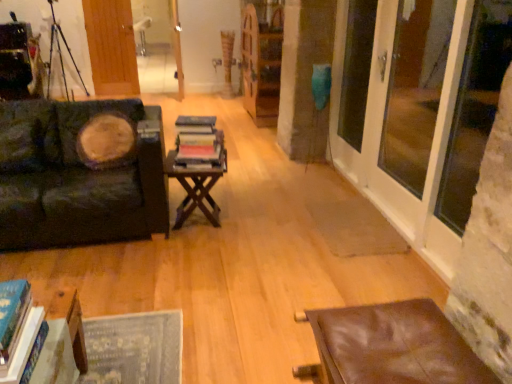
The width and height of the screenshot is (512, 384). Find the location of `free spot above hardcover books at center (from a real-world perspective)`. free spot above hardcover books at center (from a real-world perspective) is located at coordinates (194, 121).